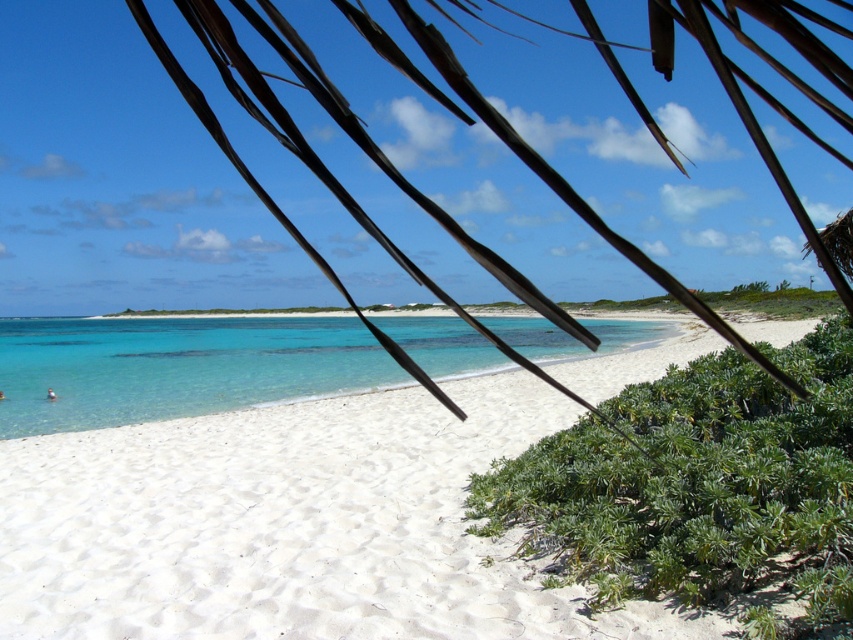
Question: Does green leafy bush at lower right have a smaller size compared to clear blue water at center?

Choices:
 (A) no
 (B) yes

Answer: (B)

Question: Is white sand beach at center below clear blue water at center?

Choices:
 (A) no
 (B) yes

Answer: (B)

Question: Can you confirm if white sand beach at center is positioned above green leafy bush at lower right?

Choices:
 (A) yes
 (B) no

Answer: (B)

Question: Which object appears farthest from the camera in this image?

Choices:
 (A) clear blue water at center
 (B) green leafy bush at lower right
 (C) white sand beach at center

Answer: (A)

Question: Which point appears closest to the camera in this image?

Choices:
 (A) (801, 468)
 (B) (332, 410)
 (C) (53, 332)

Answer: (A)

Question: Which object is farther from the camera taking this photo?

Choices:
 (A) clear blue water at center
 (B) green leafy bush at lower right

Answer: (A)